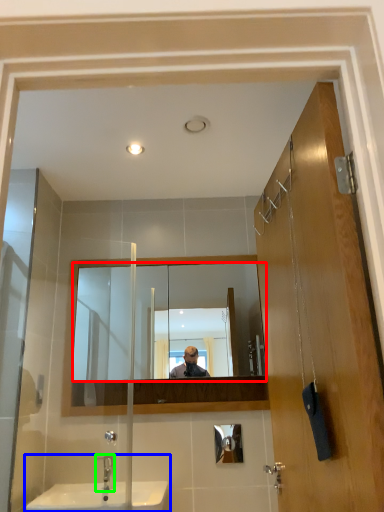
Question: Considering the real-world distances, which object is closest to mirror (highlighted by a red box)? sink (highlighted by a blue box) or tap (highlighted by a green box).

Choices:
 (A) sink
 (B) tap

Answer: (A)